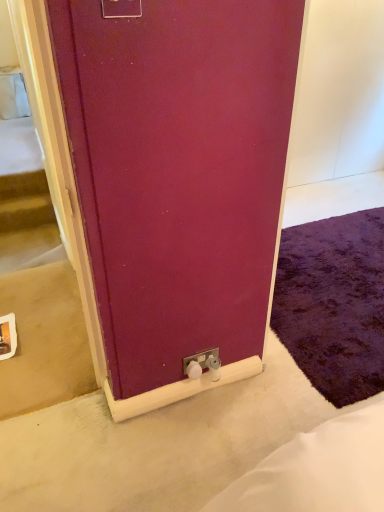
Question: Which direction should I rotate to look at white plastic electric outlet at lower center, which ranks as the 2th electric outlet in front-to-back order?

Choices:
 (A) right
 (B) left

Answer: (A)

Question: Does white plastic electric outlet at lower center, which is the 2th electric outlet in left-to-right order, have a lesser width compared to matte plastic electric outlet at upper center, the second electric outlet in the bottom-to-top sequence?

Choices:
 (A) no
 (B) yes

Answer: (B)

Question: Is matte plastic electric outlet at upper center, which appears as the first electric outlet when viewed from the left, a part of white plastic electric outlet at lower center, which ranks as the 2th electric outlet in front-to-back order?

Choices:
 (A) yes
 (B) no

Answer: (B)

Question: Is white plastic electric outlet at lower center, the 1th electric outlet positioned from the bottom, outside of matte plastic electric outlet at upper center, the first electric outlet viewed from the front?

Choices:
 (A) yes
 (B) no

Answer: (A)

Question: Considering the relative sizes of white plastic electric outlet at lower center, the 1th electric outlet positioned from the bottom, and matte plastic electric outlet at upper center, the second electric outlet in the bottom-to-top sequence, in the image provided, is white plastic electric outlet at lower center, the 1th electric outlet positioned from the bottom, shorter than matte plastic electric outlet at upper center, the second electric outlet in the bottom-to-top sequence,?

Choices:
 (A) yes
 (B) no

Answer: (A)

Question: Is white plastic electric outlet at lower center, which is the 2th electric outlet in left-to-right order, facing away from matte plastic electric outlet at upper center, which appears as the first electric outlet when viewed from the left?

Choices:
 (A) no
 (B) yes

Answer: (A)

Question: Does white plastic electric outlet at lower center, acting as the second electric outlet starting from the top, come behind matte plastic electric outlet at upper center, which appears as the first electric outlet when viewed from the left?

Choices:
 (A) no
 (B) yes

Answer: (B)

Question: Is purple shaggy rug at lower right inside matte plastic electric outlet at upper center, the first electric outlet viewed from the front?

Choices:
 (A) no
 (B) yes

Answer: (A)

Question: Is matte plastic electric outlet at upper center, which appears as the first electric outlet when viewed from the left, outside purple shaggy rug at lower right?

Choices:
 (A) no
 (B) yes

Answer: (B)

Question: From a real-world perspective, is matte plastic electric outlet at upper center, marked as the first electric outlet in a top-to-bottom arrangement, over purple shaggy rug at lower right?

Choices:
 (A) yes
 (B) no

Answer: (A)

Question: Is matte plastic electric outlet at upper center, the first electric outlet viewed from the front, further to the viewer compared to purple shaggy rug at lower right?

Choices:
 (A) no
 (B) yes

Answer: (A)

Question: Is matte plastic electric outlet at upper center, which appears as the first electric outlet when viewed from the left, to the left of purple shaggy rug at lower right from the viewer's perspective?

Choices:
 (A) no
 (B) yes

Answer: (B)

Question: Is matte plastic electric outlet at upper center, the first electric outlet viewed from the front, wider than purple shaggy rug at lower right?

Choices:
 (A) no
 (B) yes

Answer: (A)

Question: Considering the relative sizes of purple shaggy rug at lower right and matte plastic electric outlet at upper center, positioned as the second electric outlet in back-to-front order, in the image provided, is purple shaggy rug at lower right taller than matte plastic electric outlet at upper center, positioned as the second electric outlet in back-to-front order,?

Choices:
 (A) yes
 (B) no

Answer: (B)